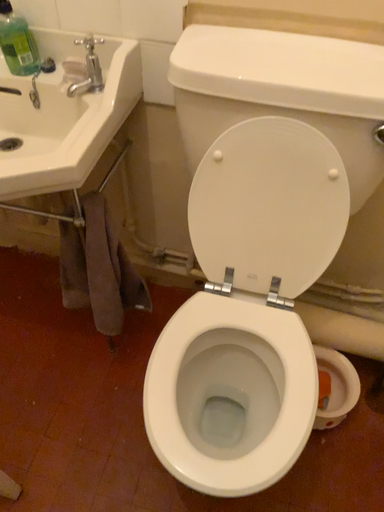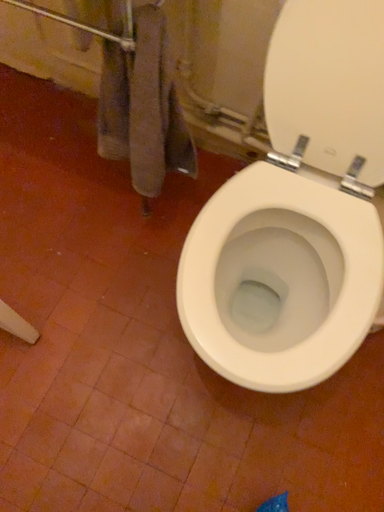
Question: How did the camera likely rotate when shooting the video?

Choices:
 (A) rotated upward
 (B) rotated downward

Answer: (B)